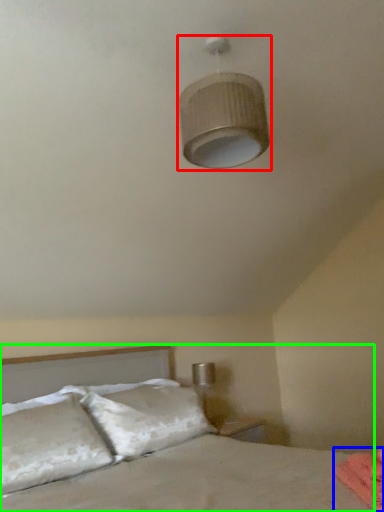
Question: Considering the real-world distances, which object is farthest from lamp (highlighted by a red box)? sheet (highlighted by a blue box) or bed (highlighted by a green box)?

Choices:
 (A) sheet
 (B) bed

Answer: (B)